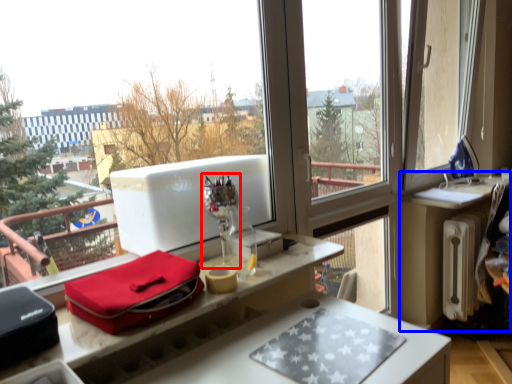
Question: Which object is further to the camera taking this photo, wine glass (highlighted by a red box) or table (highlighted by a blue box)?

Choices:
 (A) wine glass
 (B) table

Answer: (B)